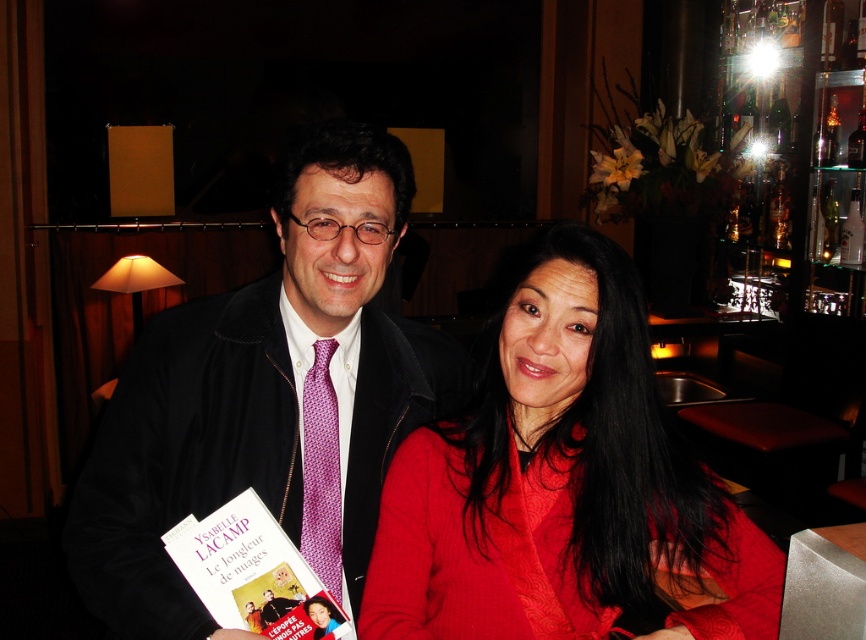
You are a tailor observing two purple ties in the image. The purple dotted tie at center and the purple woven tie at center. Which one is bigger in size?

The purple dotted tie at center has a larger size compared to the purple woven tie at center.

Looking at this image, you are an interior designer planning to place a new lamp in the room where the matte purple book at center is located. The lamp must be placed exactly 0.1 units to the right of the book. What are the coordinates for the lamp?

The coordinates for the lamp would be calculated by adding 0.1 to the x coordinate of the matte purple book at center. The original coordinates are (253, 573). Adding 0.1 to the x gives 0.997. So the lamp should be placed at point (253, 637).

You are a photographer taking a portrait of the two people in the image. You want to focus on the purple dotted tie at center. Where should you aim your camera? Please provide coordinates in the format of x,y between 0 and 1.

You should aim your camera at the coordinates (267, 396) to focus on the purple dotted tie at center.